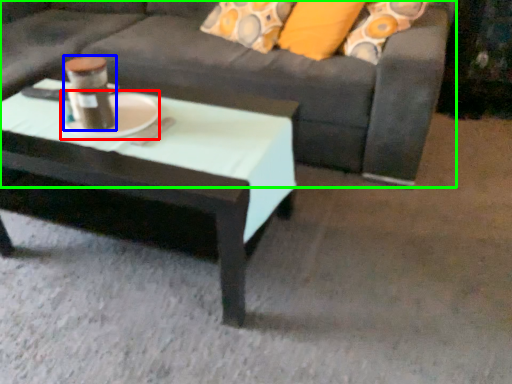
Question: Estimate the real-world distances between objects in this image. Which object is farther from platter (highlighted by a red box), beverage (highlighted by a blue box) or studio couch (highlighted by a green box)?

Choices:
 (A) beverage
 (B) studio couch

Answer: (B)